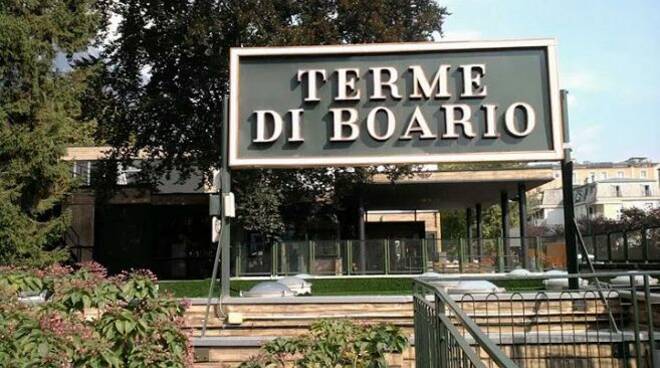
Identify the location of plant bottom left corner. (6, 286), (69, 288), (107, 286), (150, 292), (156, 343), (117, 358), (33, 357), (28, 333), (92, 328).